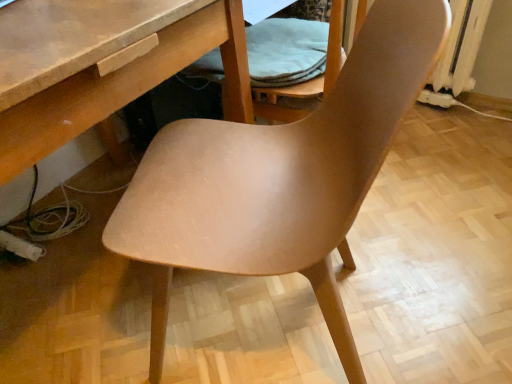
At what (x,y) coordinates should I click in order to perform the action: click on vacant space to the right of matte wood chair at center. Please return your answer as a coordinate pair (x, y). Image resolution: width=512 pixels, height=384 pixels. Looking at the image, I should click on (418, 284).